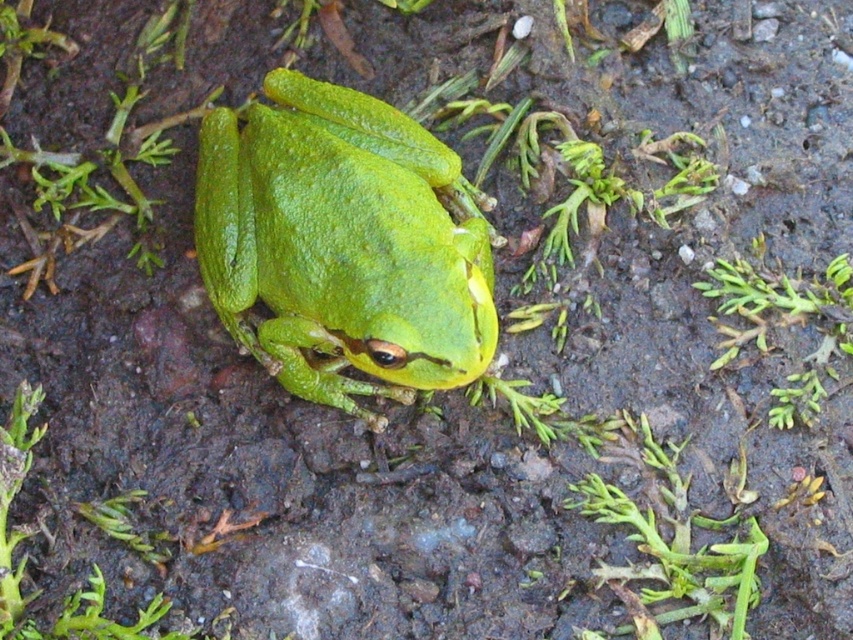
Looking at this image, who is higher up, green matte tree frog at center or green leafy weed at lower left?

green matte tree frog at center is higher up.

This screenshot has height=640, width=853. In order to click on green matte tree frog at center in this screenshot , I will do `click(343, 244)`.